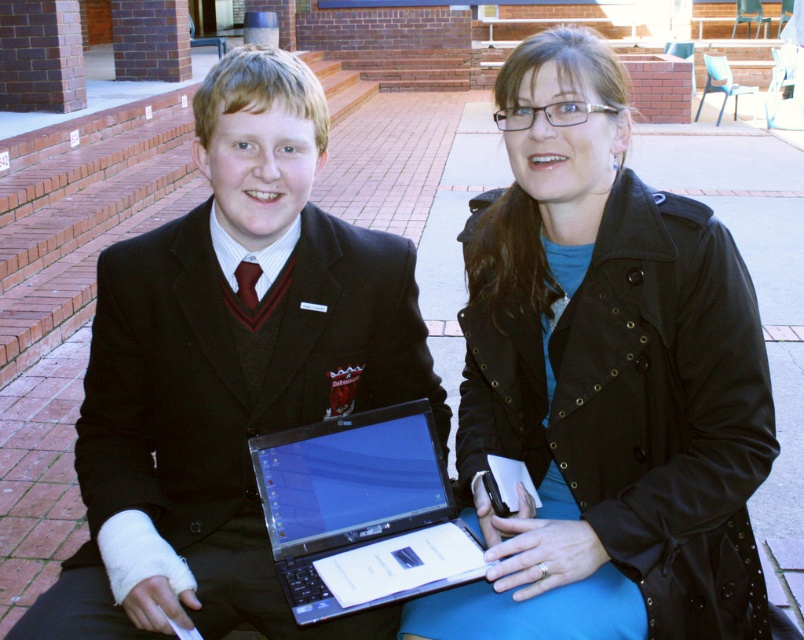
Does black matte suit at center appear under silver metallic laptop at center?

Actually, black matte suit at center is above silver metallic laptop at center.

Which of these two, black matte suit at center or silver metallic laptop at center, stands taller?

Standing taller between the two is black matte suit at center.

Which is in front, point (150, 490) or point (441, 497)?

Point (150, 490) is in front.

At what (x,y) coordinates should I click in order to perform the action: click on black matte suit at center. Please return your answer as a coordinate pair (x, y). The image size is (804, 640). Looking at the image, I should click on (228, 371).

Does matte black jacket at center have a greater width compared to silver metallic laptop at center?

Yes.

Does matte black jacket at center have a lesser width compared to silver metallic laptop at center?

No.

Is point (536, 74) farther from viewer compared to point (388, 528)?

No, (536, 74) is closer to viewer.

Where is `matte black jacket at center`? This screenshot has width=804, height=640. matte black jacket at center is located at coordinates (603, 381).

Who is more distant from viewer, (461, 403) or (327, 358)?

Positioned behind is point (461, 403).

At what (x,y) coordinates should I click in order to perform the action: click on matte black jacket at center. Please return your answer as a coordinate pair (x, y). The height and width of the screenshot is (640, 804). Looking at the image, I should click on (603, 381).